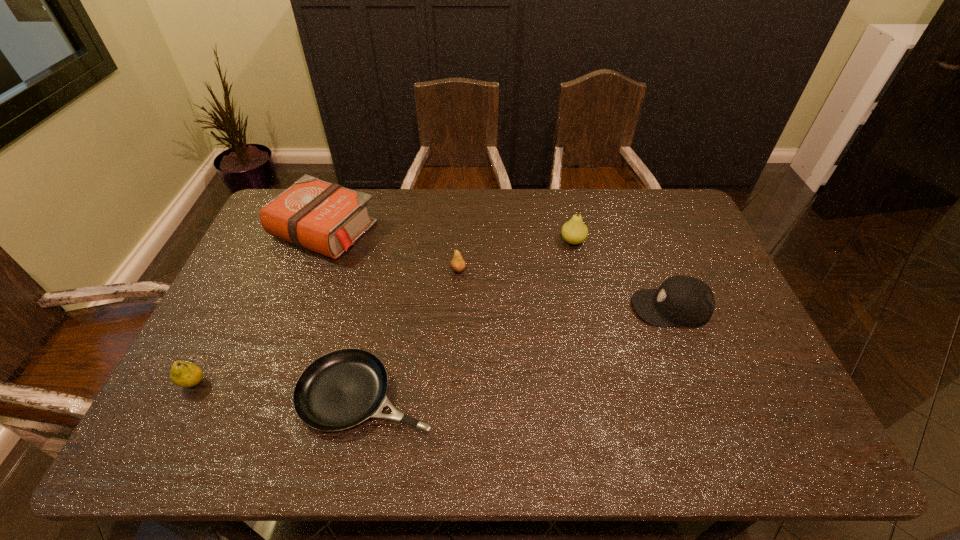
Locate an element on the screen. The image size is (960, 540). free spot between the fifth object from left to right and the nearest pear is located at coordinates (383, 312).

At what (x,y) coordinates should I click in order to perform the action: click on vacant space that is in between the pan and the rightmost object. Please return your answer as a coordinate pair (x, y). This screenshot has width=960, height=540. Looking at the image, I should click on (519, 351).

At what (x,y) coordinates should I click in order to perform the action: click on unoccupied position between the leftmost pear and the rightmost object. Please return your answer as a coordinate pair (x, y). The width and height of the screenshot is (960, 540). Looking at the image, I should click on (433, 345).

Locate an element on the screen. This screenshot has width=960, height=540. free space between the pan and the second nearest pear is located at coordinates (413, 332).

I want to click on free space between the nearest pear and the third object from right to left, so click(x=326, y=326).

Identify the location of free space between the cap and the tallest pear. (622, 274).

Identify the location of empty location between the farthest pear and the Bible. (448, 236).

Locate an element on the screen. The image size is (960, 540). empty location between the fourth farthest object and the shortest object is located at coordinates [519, 351].

Where is `object identified as the fifth closest to the leftmost pear`? The height and width of the screenshot is (540, 960). object identified as the fifth closest to the leftmost pear is located at coordinates (686, 301).

You are a GUI agent. You are given a task and a screenshot of the screen. Output one action in this format:
    pyautogui.click(x=<x>, y=<y>)
    Task: Click on the object that ranks as the closest to the second pear from right to left
    
    Given the screenshot: What is the action you would take?
    pyautogui.click(x=327, y=218)